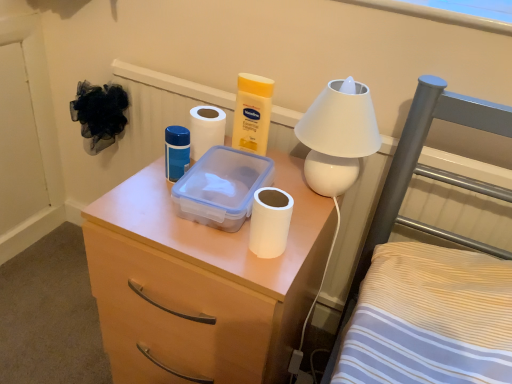
Where is `vacant region to the right of blue matte container at center`? vacant region to the right of blue matte container at center is located at coordinates (288, 190).